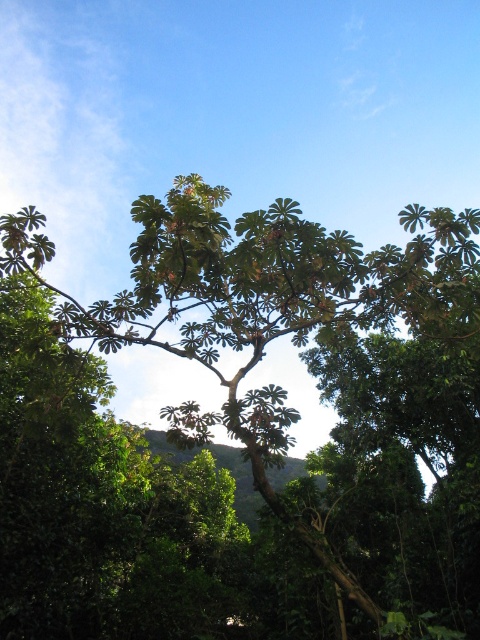
Question: In this image, where is green leafy tree at center located relative to green leafy hillside at center?

Choices:
 (A) below
 (B) above

Answer: (B)

Question: Which point is farther from the camera taking this photo?

Choices:
 (A) (216, 452)
 (B) (173, 412)

Answer: (A)

Question: Does green leafy tree at center lie behind green leafy hillside at center?

Choices:
 (A) yes
 (B) no

Answer: (B)

Question: Which point is farther to the camera?

Choices:
 (A) green leafy tree at center
 (B) green leafy hillside at center

Answer: (B)

Question: Can you confirm if green leafy tree at center is wider than green leafy hillside at center?

Choices:
 (A) no
 (B) yes

Answer: (B)